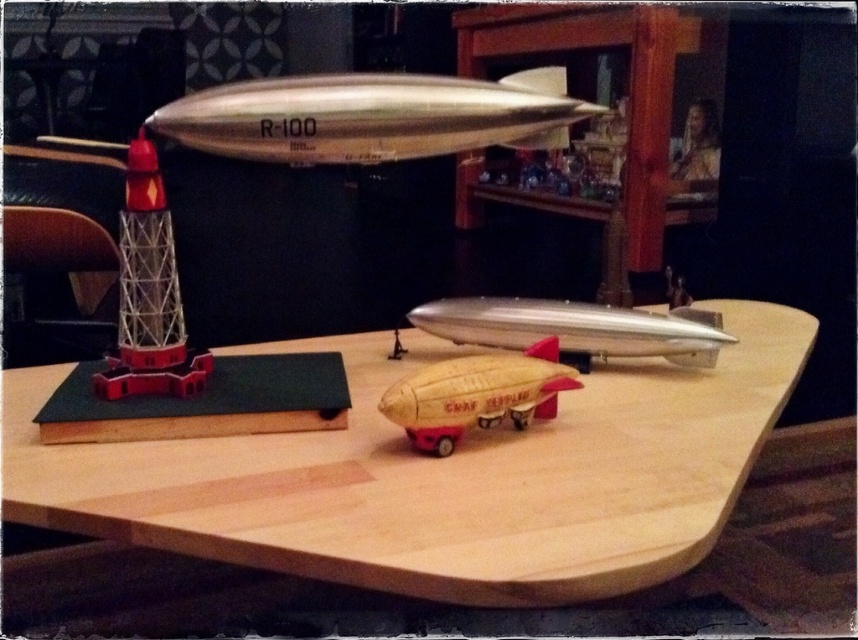
Does metallic silver rocket at upper center appear over silver metallic airplane at center?

Yes.

Measure the distance between point (234, 116) and camera.

Point (234, 116) is 23.74 inches from camera.

Locate an element on the screen. The width and height of the screenshot is (858, 640). metallic silver rocket at upper center is located at coordinates (373, 116).

Is point (482, 337) closer to camera compared to point (675, 172)?

Yes.

Is silver metallic airplane at center closer to camera compared to metallic silver airship at upper center?

Yes, silver metallic airplane at center is closer to the viewer.

Is point (506, 321) positioned behind point (704, 145)?

That is False.

The height and width of the screenshot is (640, 858). In order to click on silver metallic airplane at center in this screenshot , I will do `click(575, 328)`.

Describe the element at coordinates (149, 294) in the screenshot. I see `metallic lattice tower at left` at that location.

Measure the distance between metallic lattice tower at left and metallic silver airship at upper center.

metallic lattice tower at left is 1.46 meters from metallic silver airship at upper center.

Identify the location of metallic lattice tower at left. The height and width of the screenshot is (640, 858). (149, 294).